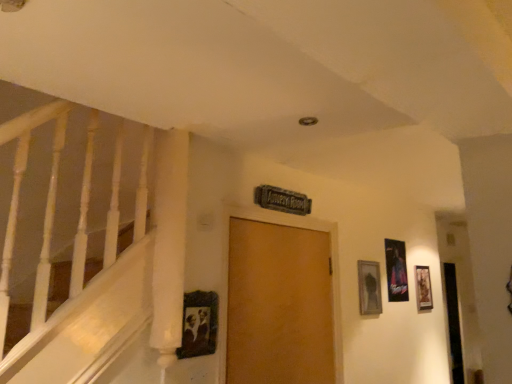
Locate an element on the screen. The image size is (512, 384). wooden vintage frame at center, acting as the fourth picture frame starting from the right is located at coordinates (199, 324).

Based on the photo, what is the approximate width of wooden vintage frame at center, the first picture frame in the left-to-right sequence?

wooden vintage frame at center, the first picture frame in the left-to-right sequence, is 1.01 inches in width.

Find the location of a particular element. wooden door at center is located at coordinates (279, 305).

This screenshot has width=512, height=384. What do you see at coordinates (279, 305) in the screenshot?
I see `wooden door at center` at bounding box center [279, 305].

Identify the location of wooden picture frame at right, which is the fourth picture frame from front to back. (423, 288).

Is metallic silver picture frame at right, placed as the third picture frame when sorted from front to back, oriented towards wooden vintage frame at center, the fourth picture frame in the back-to-front sequence?

No, metallic silver picture frame at right, placed as the third picture frame when sorted from front to back, is not turned towards wooden vintage frame at center, the fourth picture frame in the back-to-front sequence.

Can you confirm if metallic silver picture frame at right, the second picture frame in the right-to-left sequence, is thinner than wooden vintage frame at center, the fourth picture frame in the back-to-front sequence?

Yes, metallic silver picture frame at right, the second picture frame in the right-to-left sequence, is thinner than wooden vintage frame at center, the fourth picture frame in the back-to-front sequence.

Are metallic silver picture frame at right, the second picture frame in the right-to-left sequence, and wooden vintage frame at center, the fourth picture frame in the back-to-front sequence, far apart?

Yes, metallic silver picture frame at right, the second picture frame in the right-to-left sequence, and wooden vintage frame at center, the fourth picture frame in the back-to-front sequence, are located far from each other.

Which is farther from the camera, (293, 328) or (420, 272)?

The point (420, 272) is farther.

Looking at this image, between wooden door at center and wooden picture frame at right, acting as the 4th picture frame starting from the left, which one appears on the right side from the viewer's perspective?

From the viewer's perspective, wooden picture frame at right, acting as the 4th picture frame starting from the left, appears more on the right side.

From a real-world perspective, which is physically above, wooden door at center or wooden picture frame at right, acting as the 4th picture frame starting from the left?

wooden picture frame at right, acting as the 4th picture frame starting from the left, is physically above.

How different are the orientations of wooden picture frame at right, acting as the 4th picture frame starting from the left, and wooden door at center in degrees?

They differ by 0.00298 degrees in their facing directions.

Considering the relative sizes of wooden picture frame at right, which ranks as the 1th picture frame in back-to-front order, and wooden door at center in the image provided, is wooden picture frame at right, which ranks as the 1th picture frame in back-to-front order, wider than wooden door at center?

No, wooden picture frame at right, which ranks as the 1th picture frame in back-to-front order, is not wider than wooden door at center.

Considering the relative positions of wooden picture frame at right, acting as the 4th picture frame starting from the left, and wooden door at center in the image provided, is wooden picture frame at right, acting as the 4th picture frame starting from the left, behind wooden door at center?

Yes, the depth of wooden picture frame at right, acting as the 4th picture frame starting from the left, is greater than that of wooden door at center.

Which is correct: wooden picture frame at right, which ranks as the 1th picture frame in back-to-front order, is inside wooden door at center, or outside of it?

wooden picture frame at right, which ranks as the 1th picture frame in back-to-front order, exists outside the volume of wooden door at center.

Is metallic silver picture frame at right, the 3th picture frame viewed from the left, thinner than wooden picture frame at upper right, the second picture frame when ordered from front to back?

Indeed, metallic silver picture frame at right, the 3th picture frame viewed from the left, has a lesser width compared to wooden picture frame at upper right, the second picture frame when ordered from front to back.

Based on their positions, is metallic silver picture frame at right, the 3th picture frame viewed from the left, located to the left or right of wooden picture frame at upper right, arranged as the third picture frame when viewed from the back?

From the image, it's evident that metallic silver picture frame at right, the 3th picture frame viewed from the left, is to the right of wooden picture frame at upper right, arranged as the third picture frame when viewed from the back.

Is metallic silver picture frame at right, the 3th picture frame viewed from the left, looking in the opposite direction of wooden picture frame at upper right, marked as the 3th picture frame in a right-to-left arrangement?

That's not correct — metallic silver picture frame at right, the 3th picture frame viewed from the left, is not looking away from wooden picture frame at upper right, marked as the 3th picture frame in a right-to-left arrangement.

Is wooden picture frame at upper right, the 2th picture frame positioned from the left, placed right next to wooden vintage frame at center, the 1th picture frame viewed from the front?

They are not placed beside each other.

From the image's perspective, which one is positioned higher, wooden picture frame at upper right, the 2th picture frame positioned from the left, or wooden vintage frame at center, the first picture frame in the left-to-right sequence?

From the image's view, wooden vintage frame at center, the first picture frame in the left-to-right sequence, is above.

How distant is wooden picture frame at upper right, the 2th picture frame positioned from the left, from wooden vintage frame at center, acting as the fourth picture frame starting from the right?

wooden picture frame at upper right, the 2th picture frame positioned from the left, and wooden vintage frame at center, acting as the fourth picture frame starting from the right, are 4.38 feet apart from each other.

Between point (376, 305) and point (204, 313), which one is positioned behind?

Positioned behind is point (376, 305).

From the picture: From the image's perspective, which is below, wooden vintage frame at center, acting as the fourth picture frame starting from the right, or metallic silver picture frame at right, placed as the third picture frame when sorted from front to back?

From the image's view, metallic silver picture frame at right, placed as the third picture frame when sorted from front to back, is below.

Can you confirm if wooden vintage frame at center, the fourth picture frame in the back-to-front sequence, is thinner than metallic silver picture frame at right, the 3th picture frame viewed from the left?

In fact, wooden vintage frame at center, the fourth picture frame in the back-to-front sequence, might be wider than metallic silver picture frame at right, the 3th picture frame viewed from the left.

From a real-world perspective, does wooden vintage frame at center, the fourth picture frame in the back-to-front sequence, sit lower than metallic silver picture frame at right, placed as the third picture frame when sorted from front to back?

Yes, from a real-world perspective, wooden vintage frame at center, the fourth picture frame in the back-to-front sequence, is under metallic silver picture frame at right, placed as the third picture frame when sorted from front to back.

What are the coordinates of `picture frame that is the 3rd object above the wooden door at center (from a real-world perspective)` in the screenshot? It's located at (396, 270).

Can we say metallic silver picture frame at right, the 3th picture frame viewed from the left, lies outside wooden door at center?

metallic silver picture frame at right, the 3th picture frame viewed from the left, is positioned outside wooden door at center.

In the image, is metallic silver picture frame at right, the 2th picture frame viewed from the back, on the left side or the right side of wooden door at center?

Based on their positions, metallic silver picture frame at right, the 2th picture frame viewed from the back, is located to the right of wooden door at center.

From the image's perspective, which object appears higher, metallic silver picture frame at right, the second picture frame in the right-to-left sequence, or wooden door at center?

metallic silver picture frame at right, the second picture frame in the right-to-left sequence, from the image's perspective.

From a real-world perspective, which picture frame is the 3rd one above the wooden vintage frame at center, the first picture frame in the left-to-right sequence? Please provide its 2D coordinates.

[(396, 270)]

At what (x,y) coordinates should I click in order to perform the action: click on the 2nd picture frame below the wooden door at center (from the image's perspective). Please return your answer as a coordinate pair (x, y). The height and width of the screenshot is (384, 512). Looking at the image, I should click on (423, 288).

When comparing their distances from metallic silver picture frame at right, the second picture frame in the right-to-left sequence, does wooden vintage frame at center, acting as the fourth picture frame starting from the right, or wooden door at center seem further?

The object further to metallic silver picture frame at right, the second picture frame in the right-to-left sequence, is wooden vintage frame at center, acting as the fourth picture frame starting from the right.

In the scene shown: Based on their spatial positions, is metallic silver picture frame at right, placed as the third picture frame when sorted from front to back, or wooden vintage frame at center, the first picture frame in the left-to-right sequence, further from wooden picture frame at upper right, the second picture frame when ordered from front to back?

Among the two, wooden vintage frame at center, the first picture frame in the left-to-right sequence, is located further to wooden picture frame at upper right, the second picture frame when ordered from front to back.

Looking at the image, which one is located further to metallic silver picture frame at right, the second picture frame in the right-to-left sequence, wooden picture frame at upper right, marked as the 3th picture frame in a right-to-left arrangement, or wooden vintage frame at center, the first picture frame in the left-to-right sequence?

wooden vintage frame at center, the first picture frame in the left-to-right sequence, is positioned further to the anchor metallic silver picture frame at right, the second picture frame in the right-to-left sequence.

From the image, which object appears to be farther from wooden vintage frame at center, acting as the fourth picture frame starting from the right, wooden door at center or wooden picture frame at upper right, the second picture frame when ordered from front to back?

wooden picture frame at upper right, the second picture frame when ordered from front to back, is positioned further to the anchor wooden vintage frame at center, acting as the fourth picture frame starting from the right.

From the image, which object appears to be nearer to wooden vintage frame at center, the 1th picture frame viewed from the front, wooden picture frame at upper right, arranged as the third picture frame when viewed from the back, or wooden door at center?

wooden door at center.

Looking at the image, which one is located further to wooden vintage frame at center, the 1th picture frame viewed from the front, wooden picture frame at upper right, arranged as the third picture frame when viewed from the back, or metallic silver picture frame at right, the second picture frame in the right-to-left sequence?

metallic silver picture frame at right, the second picture frame in the right-to-left sequence, is positioned further to the anchor wooden vintage frame at center, the 1th picture frame viewed from the front.

Looking at the image, which one is located further to wooden picture frame at upper right, marked as the 3th picture frame in a right-to-left arrangement, wooden picture frame at right, which is the fourth picture frame from front to back, or wooden vintage frame at center, the 1th picture frame viewed from the front?

wooden vintage frame at center, the 1th picture frame viewed from the front, is positioned further to the anchor wooden picture frame at upper right, marked as the 3th picture frame in a right-to-left arrangement.

From the image, which object appears to be farther from wooden picture frame at right, which ranks as the first picture frame in right-to-left order, wooden door at center or wooden picture frame at upper right, the second picture frame when ordered from front to back?

The object further to wooden picture frame at right, which ranks as the first picture frame in right-to-left order, is wooden door at center.

This screenshot has width=512, height=384. Find the location of `door between wooden vintage frame at center, the 1th picture frame viewed from the front, and wooden picture frame at right, which is the fourth picture frame from front to back, in the front-back direction`. door between wooden vintage frame at center, the 1th picture frame viewed from the front, and wooden picture frame at right, which is the fourth picture frame from front to back, in the front-back direction is located at coordinates (279, 305).

Locate an element on the screen. door between wooden vintage frame at center, acting as the fourth picture frame starting from the right, and metallic silver picture frame at right, the 2th picture frame viewed from the back, along the z-axis is located at coordinates [x=279, y=305].

This screenshot has height=384, width=512. In order to click on picture frame between wooden vintage frame at center, acting as the fourth picture frame starting from the right, and metallic silver picture frame at right, placed as the third picture frame when sorted from front to back, along the z-axis in this screenshot , I will do `click(369, 287)`.

Where is `picture frame between wooden door at center and metallic silver picture frame at right, placed as the third picture frame when sorted from front to back, along the z-axis`? The image size is (512, 384). picture frame between wooden door at center and metallic silver picture frame at right, placed as the third picture frame when sorted from front to back, along the z-axis is located at coordinates (369, 287).